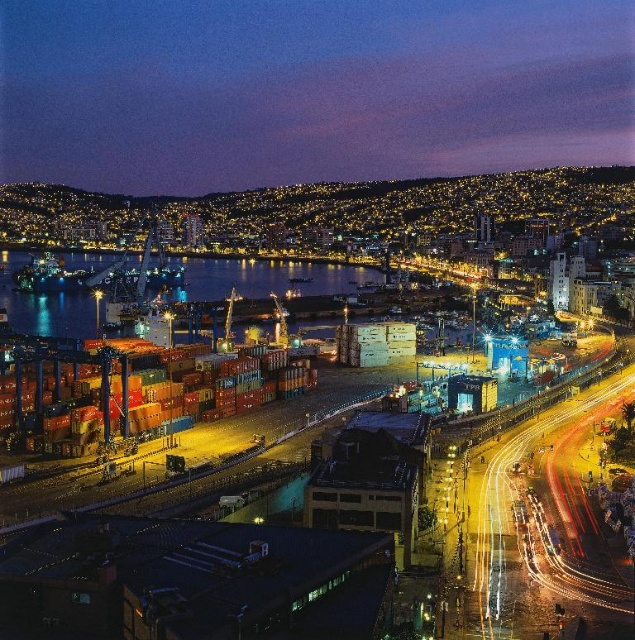
Question: Does metallic containers at center have a greater width compared to dark blue water at center?

Choices:
 (A) no
 (B) yes

Answer: (A)

Question: Does metallic containers at center have a smaller size compared to dark blue water at center?

Choices:
 (A) no
 (B) yes

Answer: (B)

Question: Is metallic containers at center behind dark blue water at center?

Choices:
 (A) no
 (B) yes

Answer: (A)